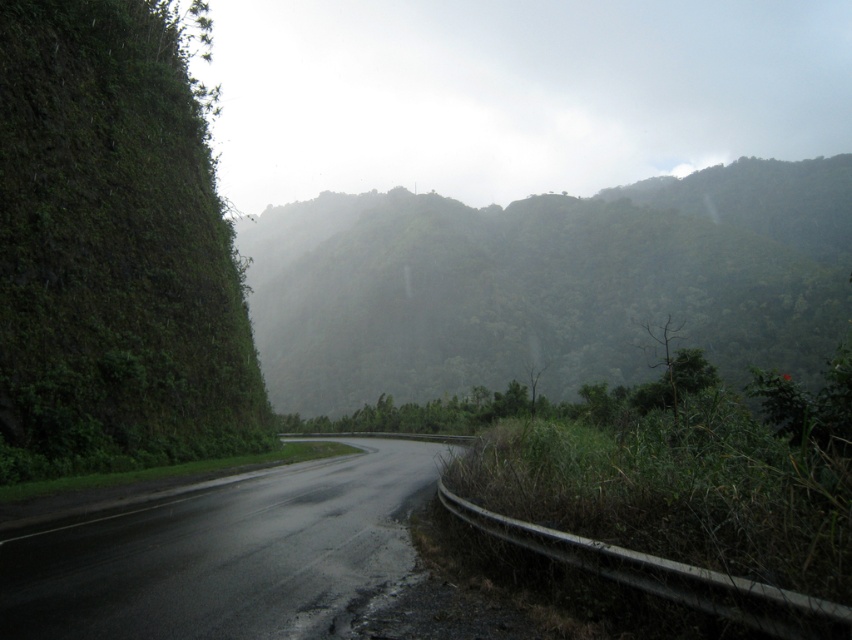
Is green leafy mountain at center bigger than green leafy wall at left?

Indeed, green leafy mountain at center has a larger size compared to green leafy wall at left.

Does green leafy mountain at center have a greater height compared to green leafy wall at left?

Correct, green leafy mountain at center is much taller as green leafy wall at left.

Is point (663, 193) closer to viewer compared to point (37, 141)?

No, it is behind (37, 141).

I want to click on green leafy mountain at center, so click(548, 284).

Image resolution: width=852 pixels, height=640 pixels. I want to click on green leafy mountain at center, so click(x=548, y=284).

Can you confirm if green leafy mountain at center is positioned above black asphalt road at center?

Yes.

Which is behind, point (565, 301) or point (160, 524)?

Point (565, 301)

Where is `green leafy mountain at center`? Image resolution: width=852 pixels, height=640 pixels. green leafy mountain at center is located at coordinates (548, 284).

Where is `green leafy wall at left`? green leafy wall at left is located at coordinates (113, 252).

Is green leafy wall at left taller than black asphalt road at center?

Indeed, green leafy wall at left has a greater height compared to black asphalt road at center.

Which is behind, point (202, 160) or point (343, 470)?

Positioned behind is point (202, 160).

You are a GUI agent. You are given a task and a screenshot of the screen. Output one action in this format:
    pyautogui.click(x=<x>, y=<y>)
    Task: Click on the green leafy wall at left
    
    Given the screenshot: What is the action you would take?
    pyautogui.click(x=113, y=252)